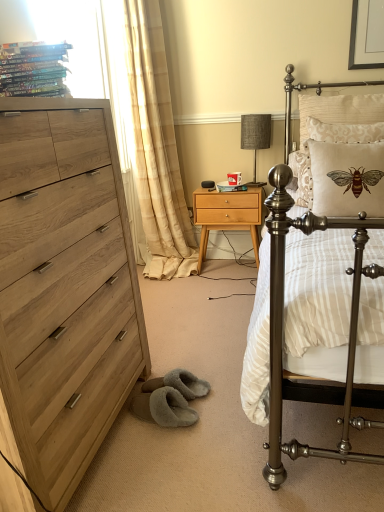
Question: From a real-world perspective, is textured fabric lampshade at upper center located beneath matte white magazine at center, the second magazine when ordered from front to back?

Choices:
 (A) no
 (B) yes

Answer: (A)

Question: Can you confirm if textured fabric lampshade at upper center is bigger than matte white magazine at center, marked as the 2th magazine in a left-to-right arrangement?

Choices:
 (A) yes
 (B) no

Answer: (A)

Question: Is textured fabric lampshade at upper center positioned beyond the bounds of matte white magazine at center, which is the 1th magazine in right-to-left order?

Choices:
 (A) no
 (B) yes

Answer: (B)

Question: Is textured fabric lampshade at upper center beside matte white magazine at center, marked as the 2th magazine in a left-to-right arrangement?

Choices:
 (A) yes
 (B) no

Answer: (B)

Question: From the image's perspective, is textured fabric lampshade at upper center located above matte white magazine at center, which is the 1th magazine in right-to-left order?

Choices:
 (A) yes
 (B) no

Answer: (A)

Question: Considering the positions of beige fabric pillow with embroidered bee at upper right, the third pillow in the back-to-front sequence, and metallic bed at right in the image, is beige fabric pillow with embroidered bee at upper right, the third pillow in the back-to-front sequence, bigger or smaller than metallic bed at right?

Choices:
 (A) small
 (B) big

Answer: (A)

Question: From a real-world perspective, is beige fabric pillow with embroidered bee at upper right, the first pillow from the front, positioned above or below metallic bed at right?

Choices:
 (A) above
 (B) below

Answer: (A)

Question: Visually, is beige fabric pillow with embroidered bee at upper right, the third pillow in the back-to-front sequence, positioned to the left or to the right of metallic bed at right?

Choices:
 (A) left
 (B) right

Answer: (A)

Question: From the image's perspective, is beige fabric pillow with embroidered bee at upper right, the third pillow in the back-to-front sequence, above or below metallic bed at right?

Choices:
 (A) above
 (B) below

Answer: (A)

Question: From a real-world perspective, is gray fuzzy slippers at lower center positioned above or below metallic bed at right?

Choices:
 (A) above
 (B) below

Answer: (B)

Question: Is gray fuzzy slippers at lower center to the left or to the right of metallic bed at right in the image?

Choices:
 (A) left
 (B) right

Answer: (A)

Question: Looking at the image, does gray fuzzy slippers at lower center seem bigger or smaller compared to metallic bed at right?

Choices:
 (A) big
 (B) small

Answer: (B)

Question: Does point (165, 424) appear closer or farther from the camera than point (284, 244)?

Choices:
 (A) closer
 (B) farther

Answer: (A)

Question: From a real-world perspective, is textured fabric lampshade at upper center positioned above or below light wood/texture nightstand at center?

Choices:
 (A) above
 (B) below

Answer: (A)

Question: Considering the positions of textured fabric lampshade at upper center and light wood/texture nightstand at center in the image, is textured fabric lampshade at upper center taller or shorter than light wood/texture nightstand at center?

Choices:
 (A) short
 (B) tall

Answer: (A)